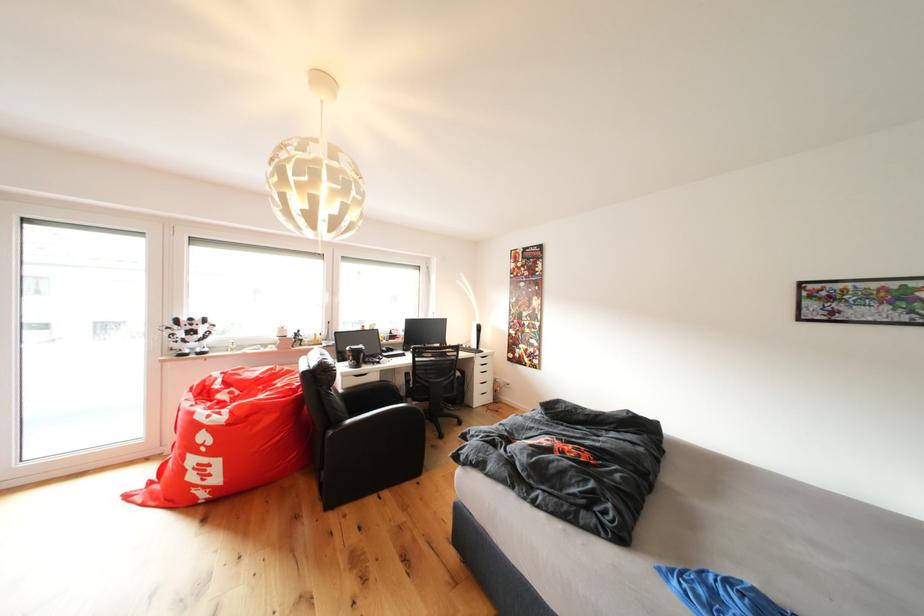
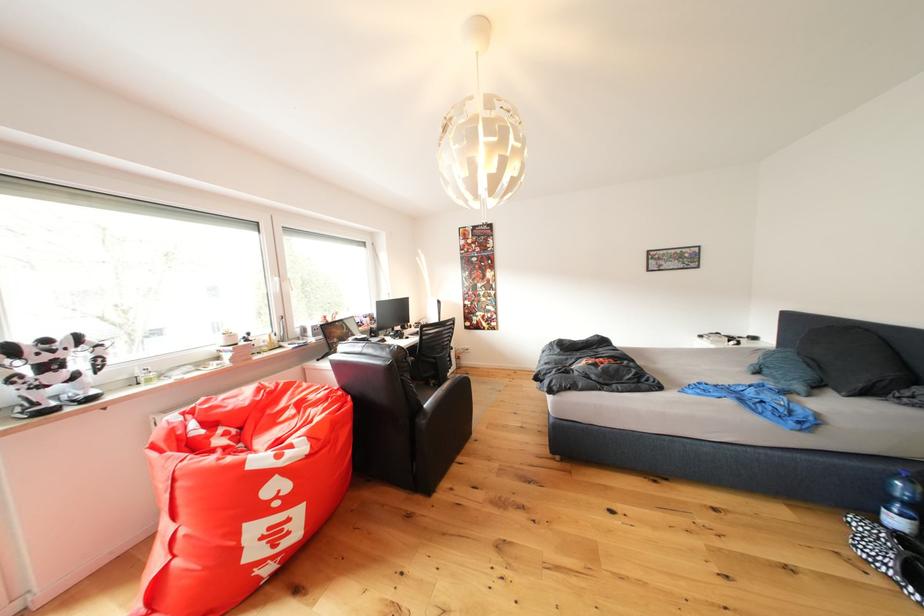
Where in the second image is the point corresponding to point (358, 427) from the first image?

(434, 410)